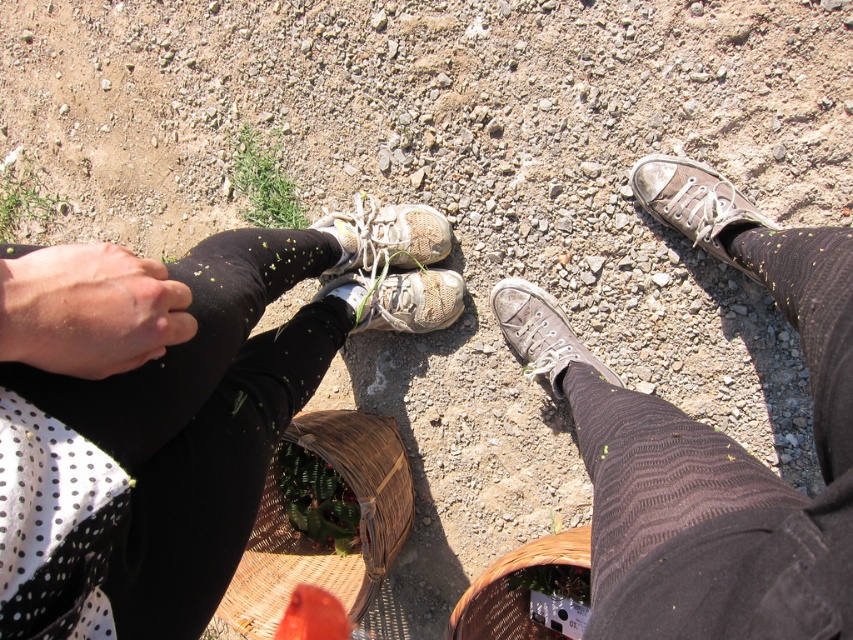
You are a photographer trying to capture the matte black leggings at lower left in the image. Based on the provided coordinates, where should you position your camera to ensure the leggings are centered in your shot?

The matte black leggings at lower left are located at coordinates point (233, 396), so you should position your camera to center the shot at those coordinates to capture them accurately.

You are trying to locate your missing sock and see the brown knitted sock at lower right and the worn canvas shoe at center. Which object is positioned more to the right side?

The brown knitted sock at lower right is positioned more to the right side than the worn canvas shoe at center.

You are trying to determine which item is wider between the matte black leggings at lower left and the worn canvas shoe at center. Based on the scene, which one has a greater width?

The matte black leggings at lower left has a greater width than the worn canvas shoe at center according to the description.